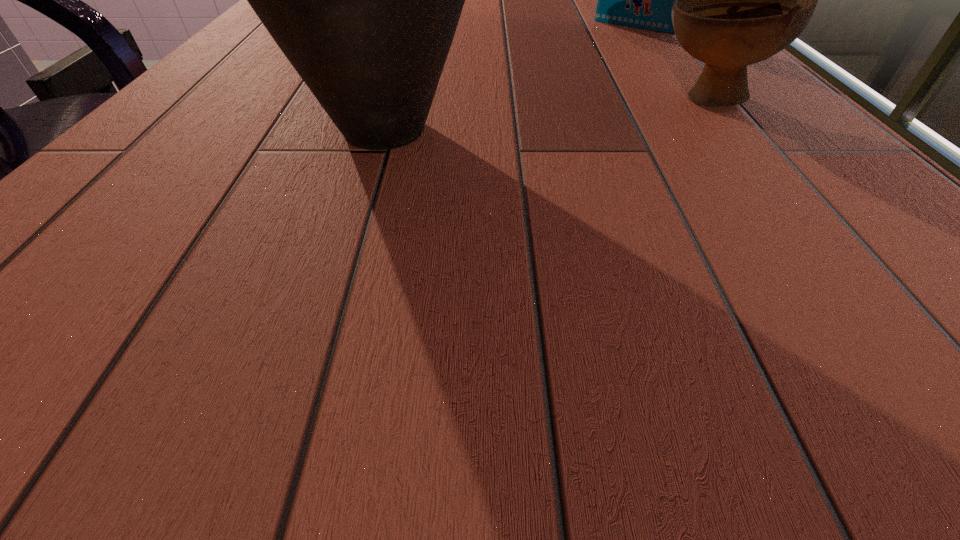
Where is `free space in the image that satisfies the following two spatial constraints: 1. on the front side of the book; 2. on the right side of the soup bowl`? This screenshot has height=540, width=960. free space in the image that satisfies the following two spatial constraints: 1. on the front side of the book; 2. on the right side of the soup bowl is located at coordinates (689, 99).

The image size is (960, 540). I want to click on blank space that satisfies the following two spatial constraints: 1. on the back side of the leftmost object; 2. on the right side of the second tallest object, so click(417, 26).

Identify the location of free space that satisfies the following two spatial constraints: 1. on the back side of the book; 2. on the left side of the tallest object. (417, 26).